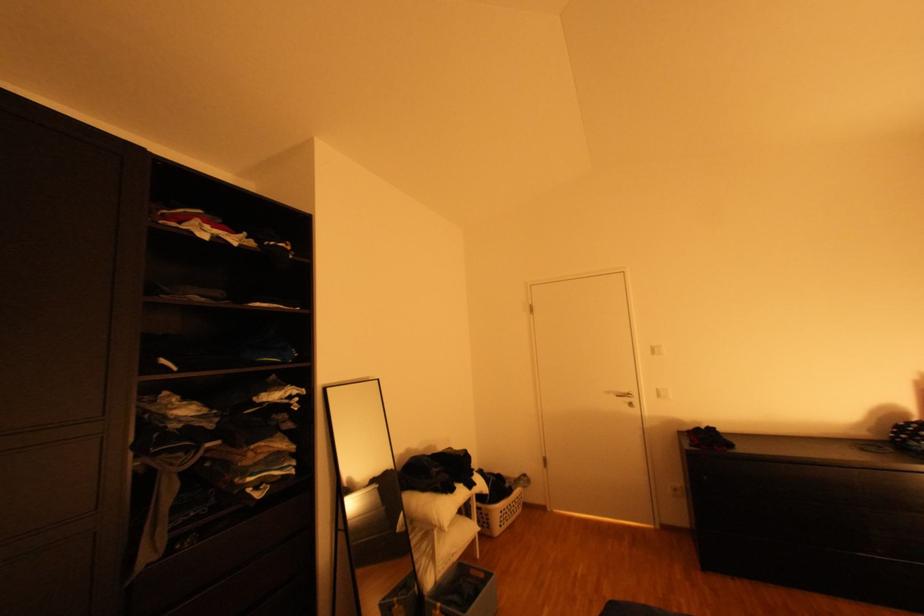
Where is `white pillow`? The width and height of the screenshot is (924, 616). white pillow is located at coordinates (432, 507).